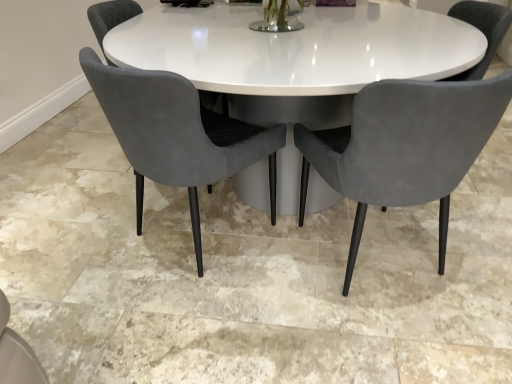
The height and width of the screenshot is (384, 512). Identify the location of unoccupied region to the right of velvet grey chair at center, which is counted as the 1th chair, starting from the right. (473, 242).